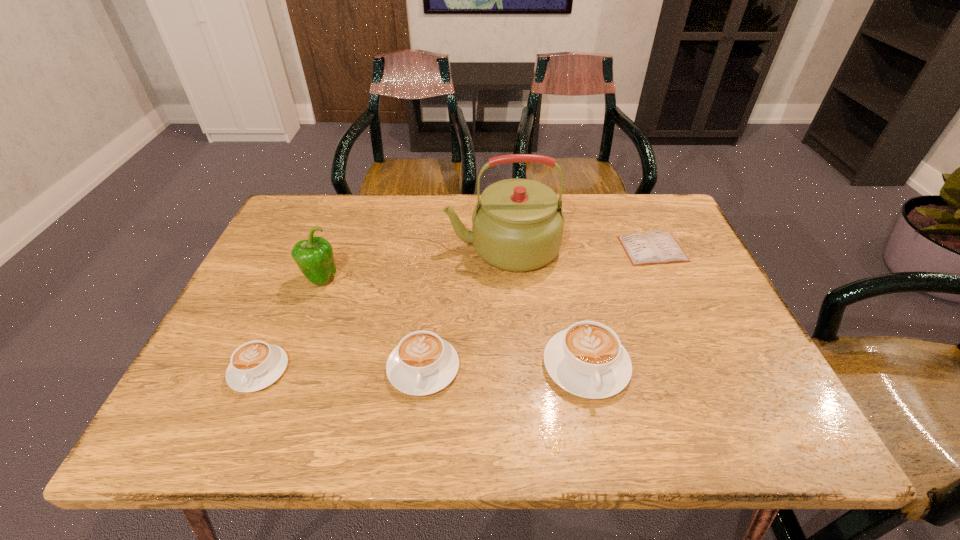
You are a GUI agent. You are given a task and a screenshot of the screen. Output one action in this format:
    pyautogui.click(x=<x>, y=<y>)
    Task: Click on the vacant space situated at the spout of the tallest object
    Image resolution: width=960 pixels, height=540 pixels.
    Given the screenshot: What is the action you would take?
    pyautogui.click(x=340, y=248)

The image size is (960, 540). Identify the location of vacant space located 0.130m at the spout of the tallest object. (398, 248).

At what (x,y) coordinates should I click in order to perform the action: click on vacant space located at the spout of the tallest object. Please return your answer as a coordinate pair (x, y). The height and width of the screenshot is (540, 960). Looking at the image, I should click on (427, 248).

Where is `free spot located 0.140m on the front of the bell pepper`? This screenshot has width=960, height=540. free spot located 0.140m on the front of the bell pepper is located at coordinates (298, 338).

Where is `vacant space located on the left of the rightmost object`? vacant space located on the left of the rightmost object is located at coordinates (556, 249).

Locate an element on the screen. kettle that is positioned at the far edge is located at coordinates (517, 225).

Where is `diary located at the far edge`? diary located at the far edge is located at coordinates (656, 247).

You are a GUI agent. You are given a task and a screenshot of the screen. Output one action in this format:
    pyautogui.click(x=<x>, y=<y>)
    Task: Click on the cappuccino that is positioned at the left edge
    The width and height of the screenshot is (960, 540).
    Given the screenshot: What is the action you would take?
    pyautogui.click(x=255, y=365)

The height and width of the screenshot is (540, 960). Find the location of `bell pepper located in the left edge section of the desktop`. bell pepper located in the left edge section of the desktop is located at coordinates (314, 257).

Locate an element on the screen. object present at the right edge is located at coordinates (656, 247).